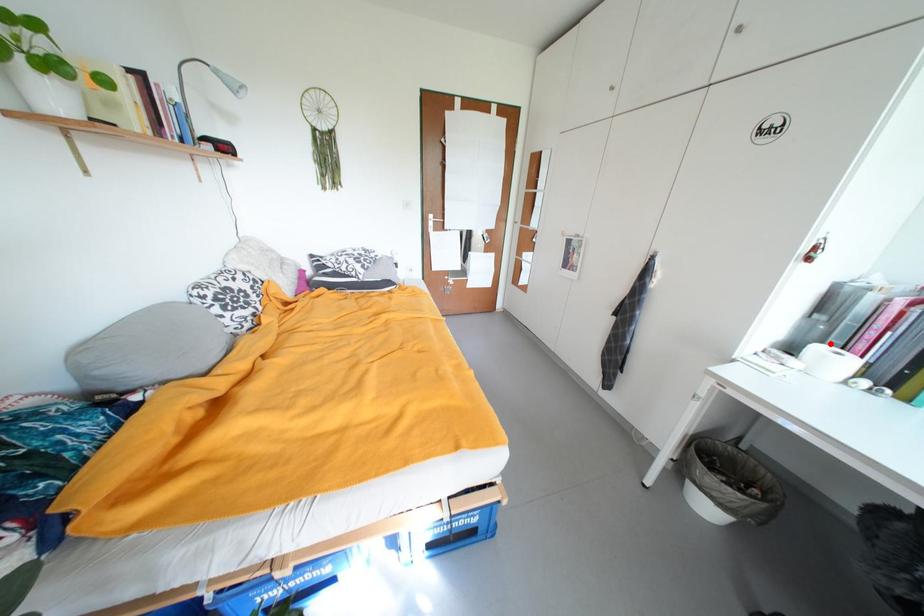
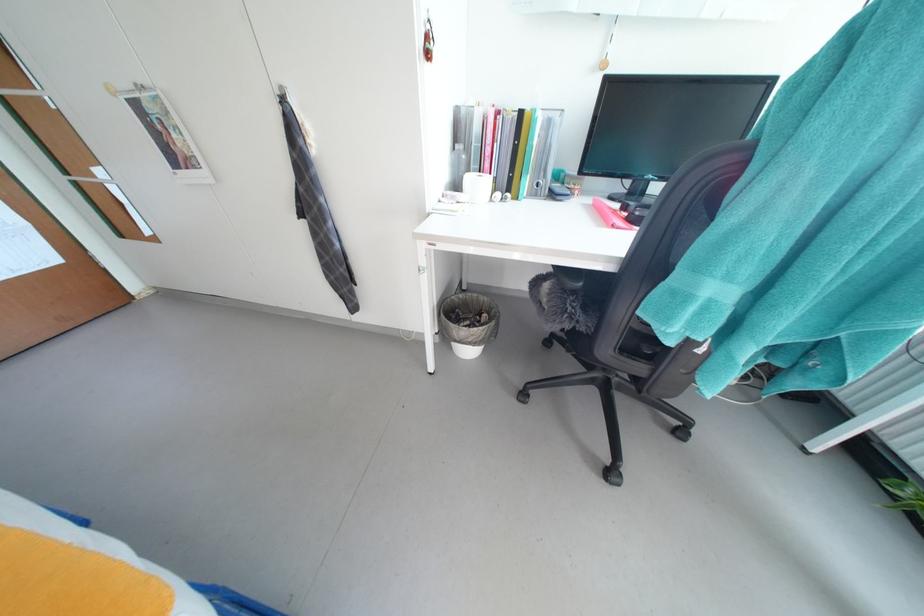
Question: I am providing you with two images of the same scene from different viewpoints. Given a red point in image1, look at the same physical point in image2. Is it:

Choices:
 (A) Closer to the viewpoint
 (B) Farther from the viewpoint

Answer: (A)